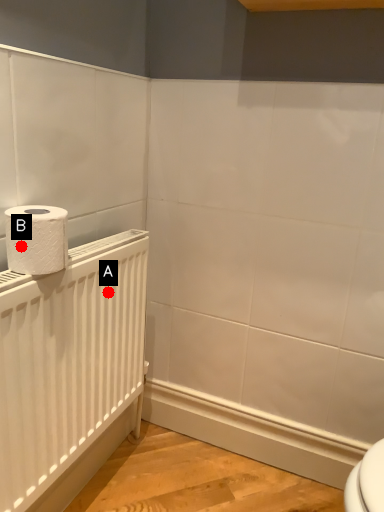
Question: Two points are circled on the image, labeled by A and B beside each circle. Which point is closer to the camera?

Choices:
 (A) A is closer
 (B) B is closer

Answer: (B)